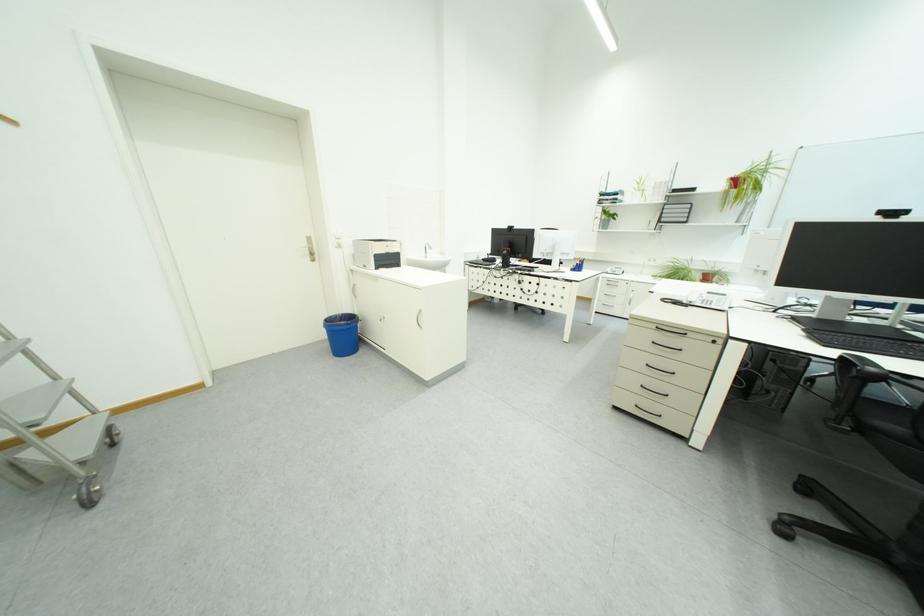
Describe the element at coordinates (913, 416) in the screenshot. The image size is (924, 616). I see `the black chair sitting surface` at that location.